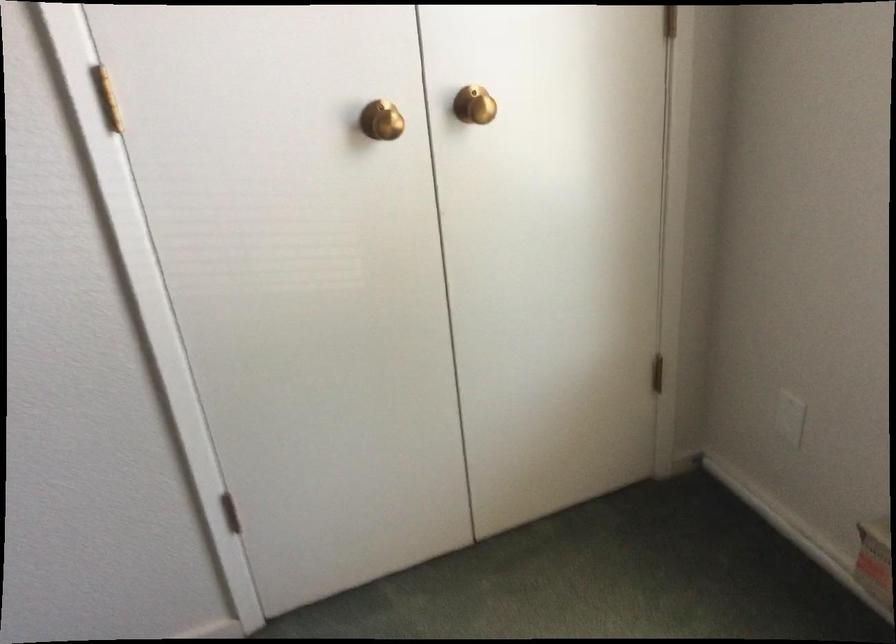
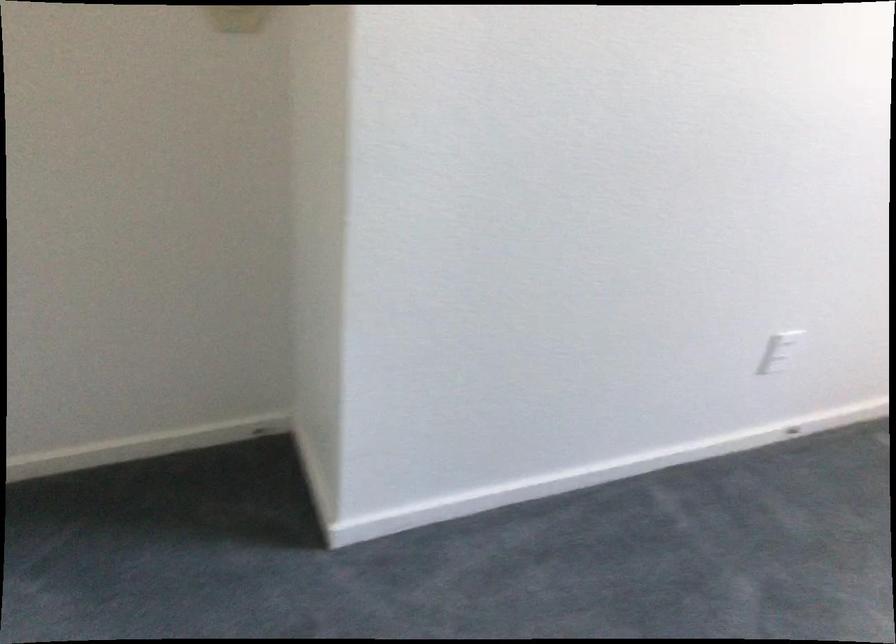
Question: Which direction would the cameraman need to move to produce the second image? Reply with the corresponding letter.

Choices:
 (A) Left
 (B) Right
 (C) Forward
 (D) Backward

Answer: (A)